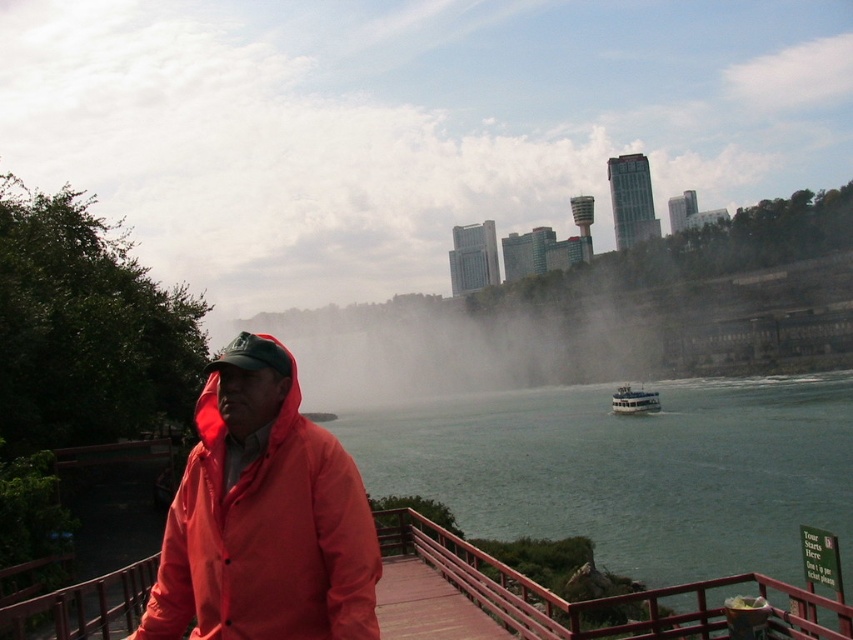
You are a photographer trying to capture a photo of the white glossy boat at lower center without the matte red jacket at center blocking it. Based on their positions, is it possible to frame the shot so that the boat is visible without the jacket?

The matte red jacket at center is positioned on the left side of white glossy boat at lower center. Since the jacket is to the left of the boat, you can frame the shot by moving the camera to the right side of the jacket to ensure the white glossy boat at lower center is visible without obstruction.

You are a photographer standing at the wooden walkway in front of Niagara Falls. You want to take a photo that includes both the man in the red jacket and the tour boat. The man is standing at point (643, 541) and the tour boat is at point (351, 632). Which object is closer to your camera so that you can focus on it first?

Point (643, 541) is further to the camera than point (351, 632), so the man in the red jacket at point (643, 541) is closer to the camera and should be focused on first.